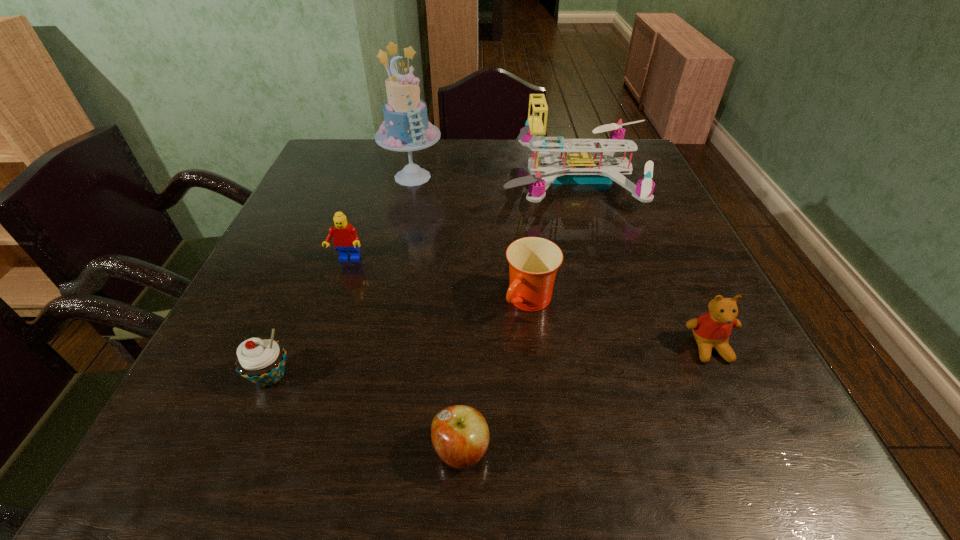
Where is `empty location between the cup and the cupcake`? This screenshot has width=960, height=540. empty location between the cup and the cupcake is located at coordinates (400, 339).

Locate which object is the sixth closest to the cupcake. Please provide its 2D coordinates. Your answer should be formatted as a tuple, i.e. [(x, y)], where the tuple contains the x and y coordinates of a point satisfying the conditions above.

[(711, 330)]

Select which object appears as the closest to the cupcake. Please provide its 2D coordinates. Your answer should be formatted as a tuple, i.e. [(x, y)], where the tuple contains the x and y coordinates of a point satisfying the conditions above.

[(345, 238)]

I want to click on vacant space that satisfies the following two spatial constraints: 1. on the front-facing side of the Lego; 2. on the left side of the fourth farthest object, so click(x=333, y=302).

Where is `free space in the image that satisfies the following two spatial constraints: 1. on the front-facing side of the drone; 2. on the front side of the fourth nearest object`? The height and width of the screenshot is (540, 960). free space in the image that satisfies the following two spatial constraints: 1. on the front-facing side of the drone; 2. on the front side of the fourth nearest object is located at coordinates (615, 302).

This screenshot has height=540, width=960. In order to click on blank space that satisfies the following two spatial constraints: 1. on the front-facing side of the Lego; 2. on the right side of the nearest object in this screenshot , I will do `click(283, 451)`.

Locate an element on the screen. free space that satisfies the following two spatial constraints: 1. with a ladder on the side of the tallest object; 2. on the right side of the cup is located at coordinates (x=386, y=302).